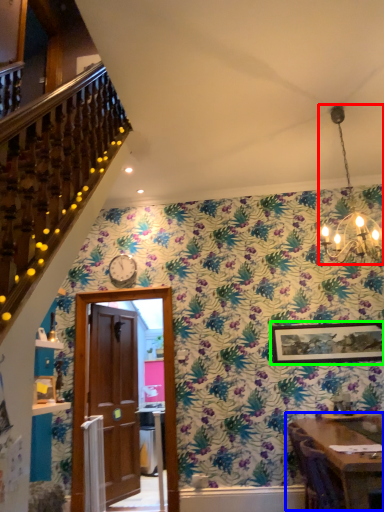
Question: Which object is positioned farthest from light fixture (highlighted by a red box)? Select from table (highlighted by a blue box) and picture frame (highlighted by a green box).

Choices:
 (A) table
 (B) picture frame

Answer: (B)